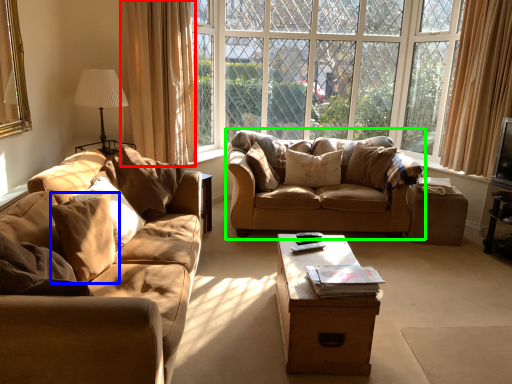
Question: Which object is positioned farthest from curtain (highlighted by a red box)? Select from pillow (highlighted by a blue box) and studio couch (highlighted by a green box).

Choices:
 (A) pillow
 (B) studio couch

Answer: (A)